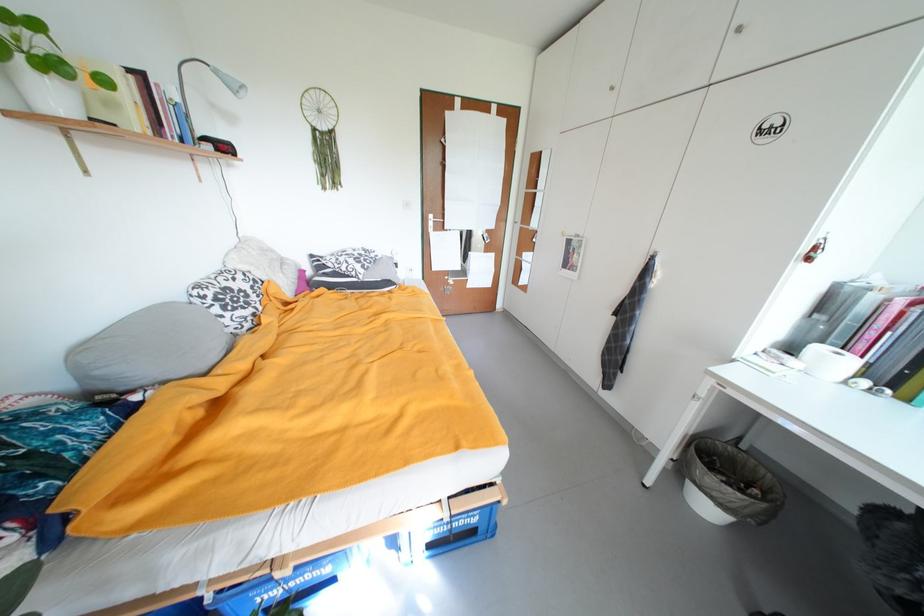
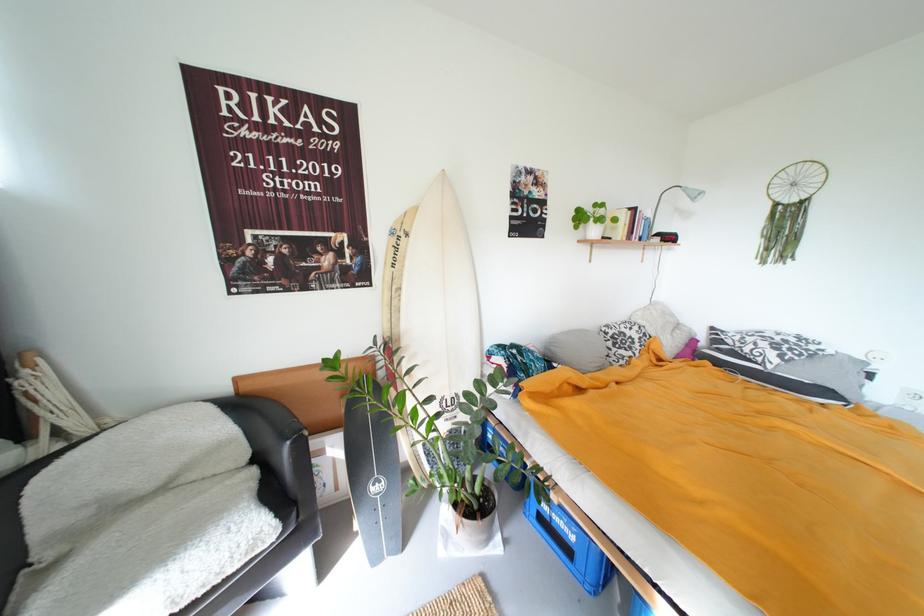
Locate, in the second image, the point that corresponds to pixel 244 90 in the first image.

(703, 198)